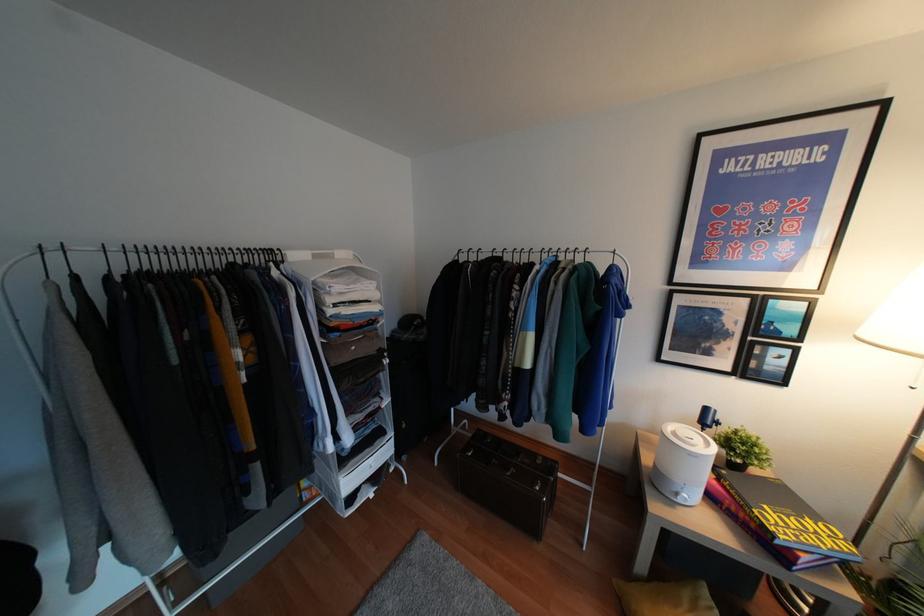
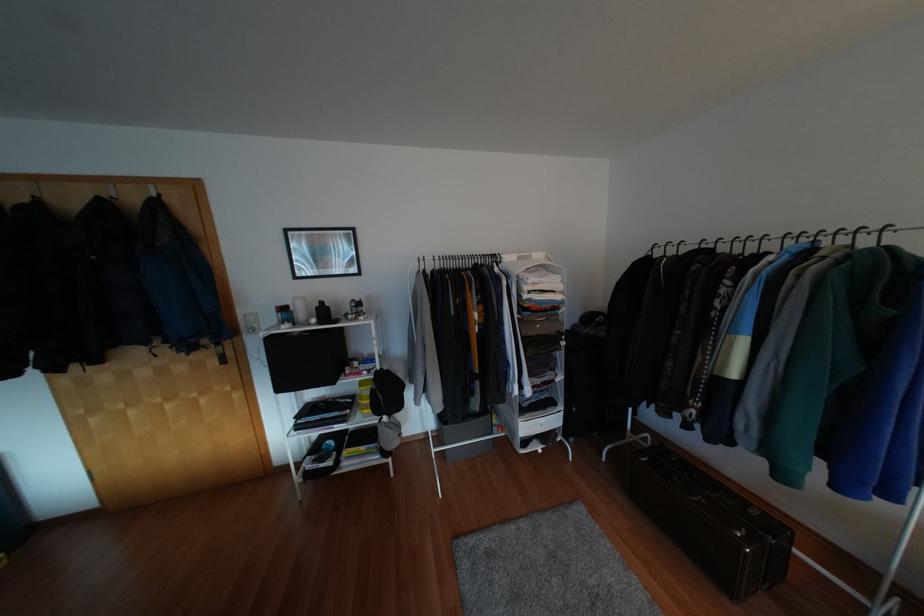
Question: The camera is either moving clockwise (left) or counter-clockwise (right) around the object. The first image is from the beginning of the video and the second image is from the end. Is the camera moving left or right when shooting the video?

Choices:
 (A) Left
 (B) Right

Answer: (B)